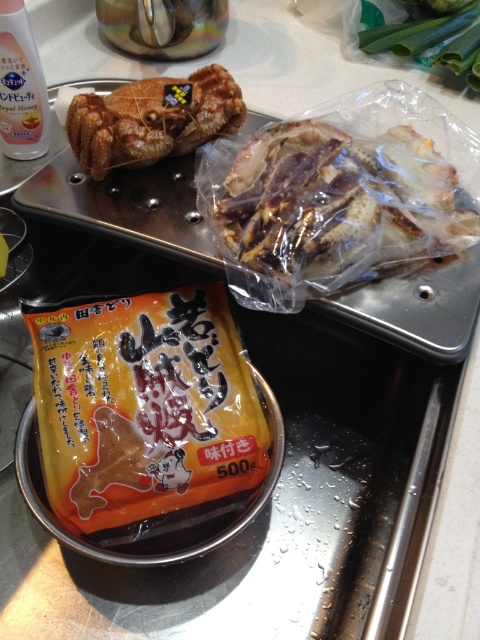
You are organizing the items on the kitchen counter. You need to place the orange matte bag at center and the translucent plastic chicken at upper right in a specific order. Which item should be placed to the left of the other?

The orange matte bag at center should be placed to the left of the translucent plastic chicken at upper right because the orange matte bag at center is positioned on the left side of translucent plastic chicken at upper right.

You are organizing a picnic basket and need to place the orange matte bag at center and the brown crispy crab at upper left. According to their positions in the image, which item should you place first into the basket to maintain their original arrangement?

The brown crispy crab at upper left should be placed first because the orange matte bag at center is positioned on the right side of it, meaning the crab is on the left and should be placed first to maintain the original arrangement.